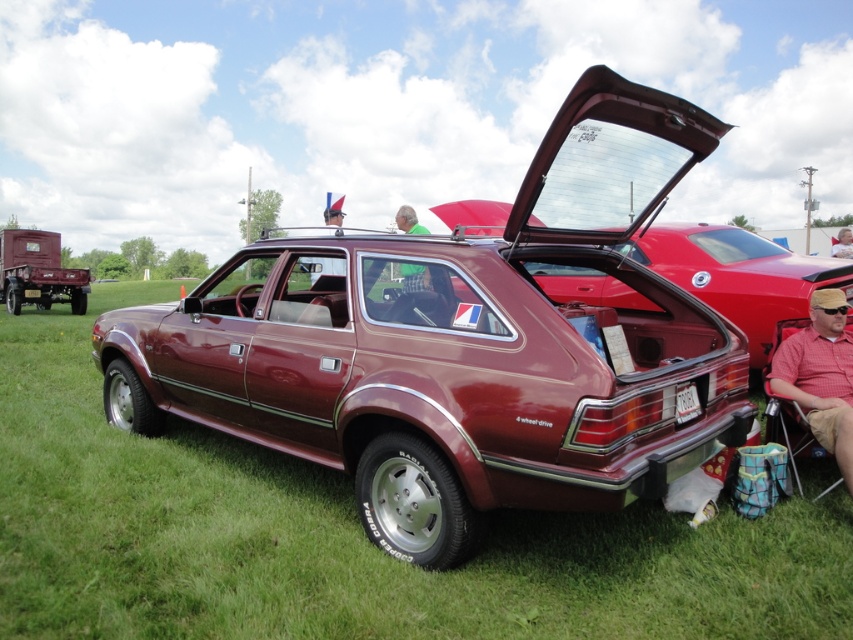
Based on the photo, you are standing in front of the maroon metallic car at center. Your backpack is 0.5 meters wide. Can you place your backpack between you and the car without touching the car?

The distance between you and the maroon metallic car at center is 2.71 meters. Since your backpack is only 0.5 meters wide, you have enough space to place it between you and the car without touching the car.

You are standing at the origin point in the grassy field where the maroon metallic car at center is parked. If you want to walk towards the car, which direction should you head?

The maroon metallic car at center is located at point 0.839 on the x and y axis, so you should walk towards the northeast direction to reach it.